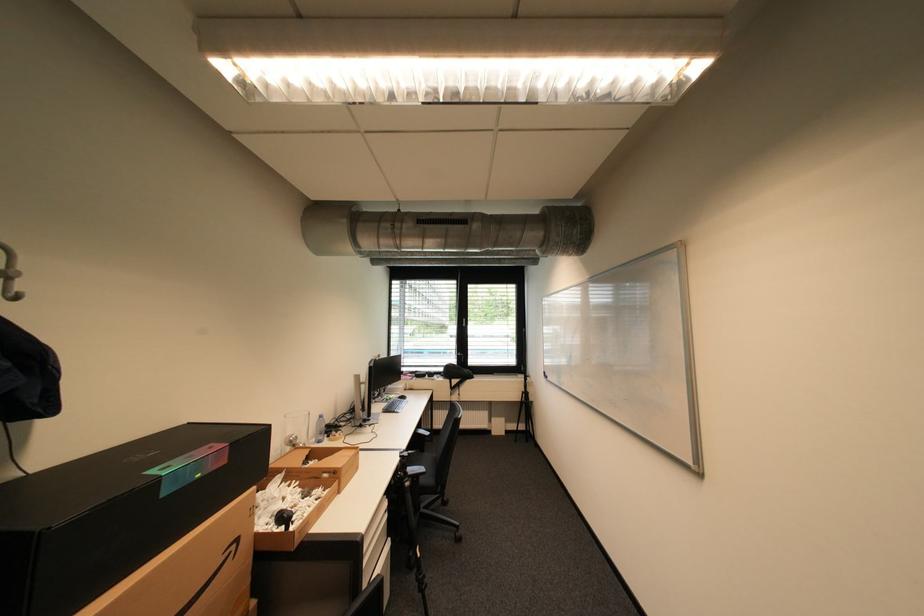
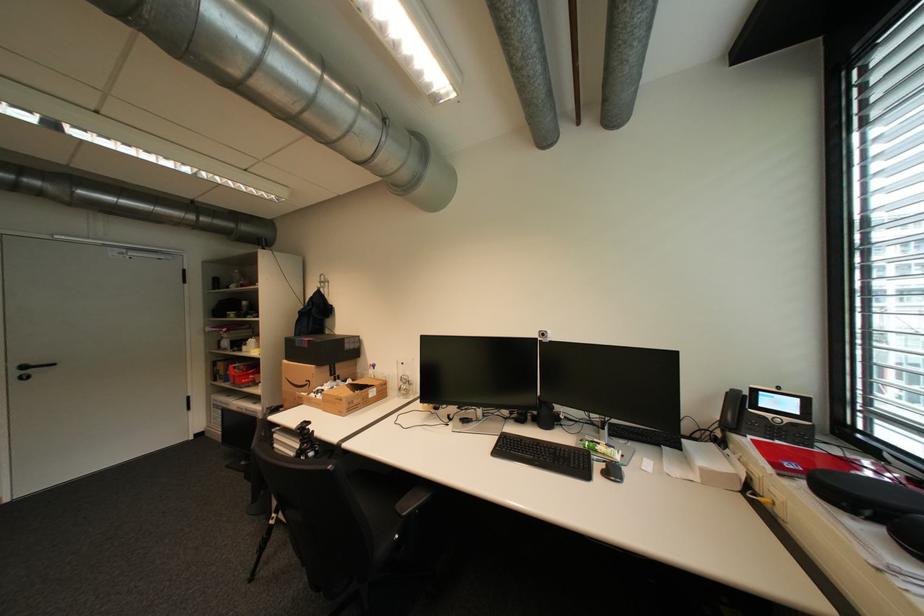
Locate, in the second image, the point that corresponds to point 207,476 in the first image.

(310, 346)